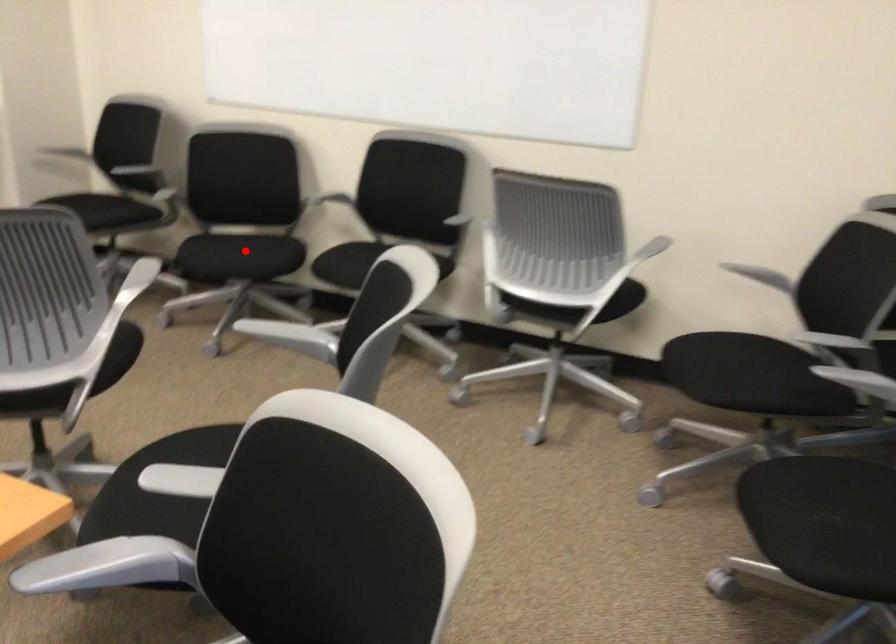
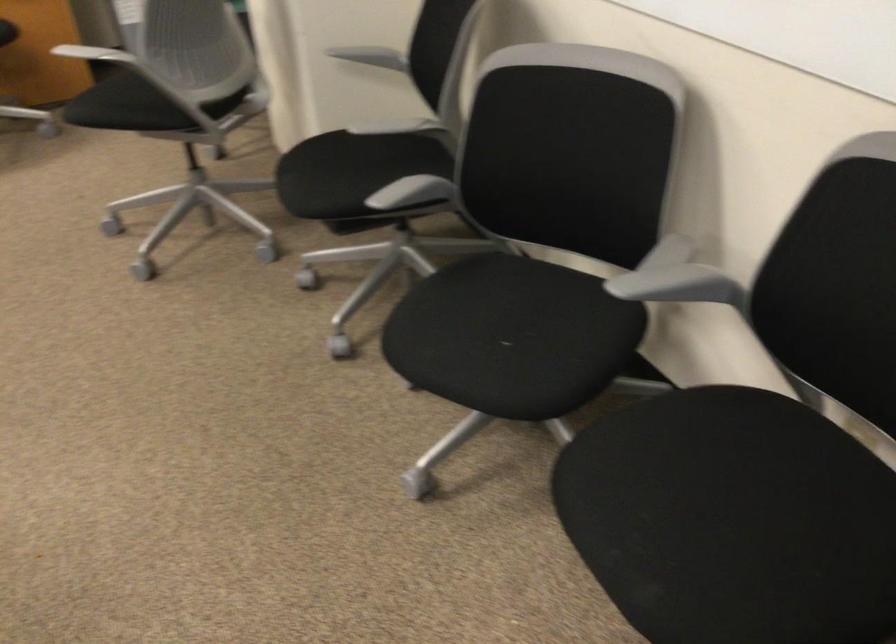
Question: I am providing you with two images of the same scene from different viewpoints. Given a red point in image1, look at the same physical point in image2. Is it:

Choices:
 (A) Closer to the viewpoint
 (B) Farther from the viewpoint

Answer: (A)